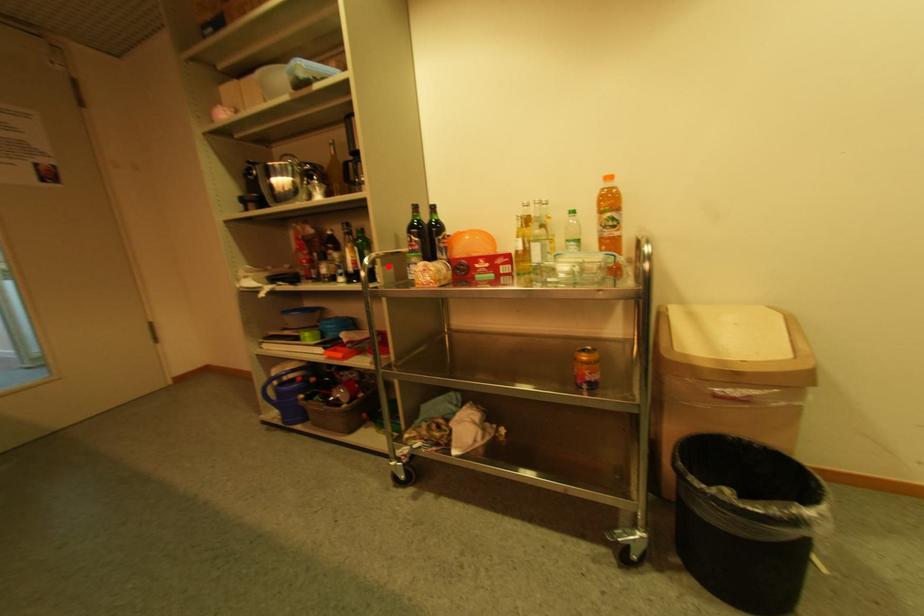
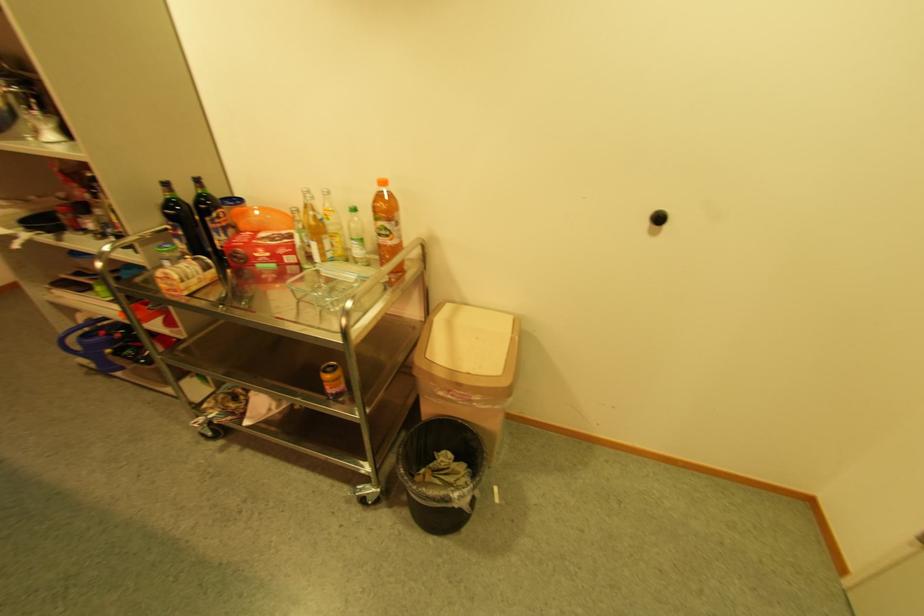
The point at the highlighted location is marked in the first image. Where is the corresponding point in the second image?

(147, 248)